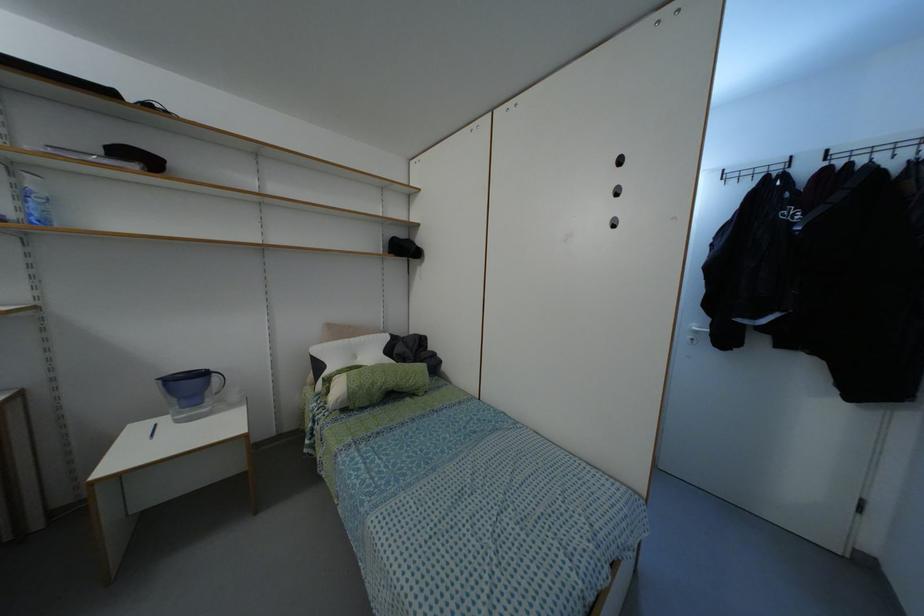
You are a GUI agent. You are given a task and a screenshot of the screen. Output one action in this format:
    pyautogui.click(x=<x>, y=<y>)
    Task: Click on the blue pitcher handle
    The image size is (924, 616).
    Given the screenshot: What is the action you would take?
    tap(215, 389)